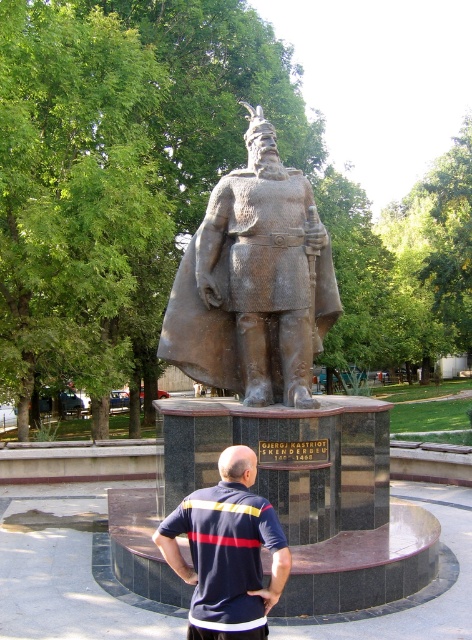
Does bronze statue at center appear on the right side of dark blue shirt at center?

Indeed, bronze statue at center is positioned on the right side of dark blue shirt at center.

At what (x,y) coordinates should I click in order to perform the action: click on bronze statue at center. Please return your answer as a coordinate pair (x, y). Looking at the image, I should click on (253, 282).